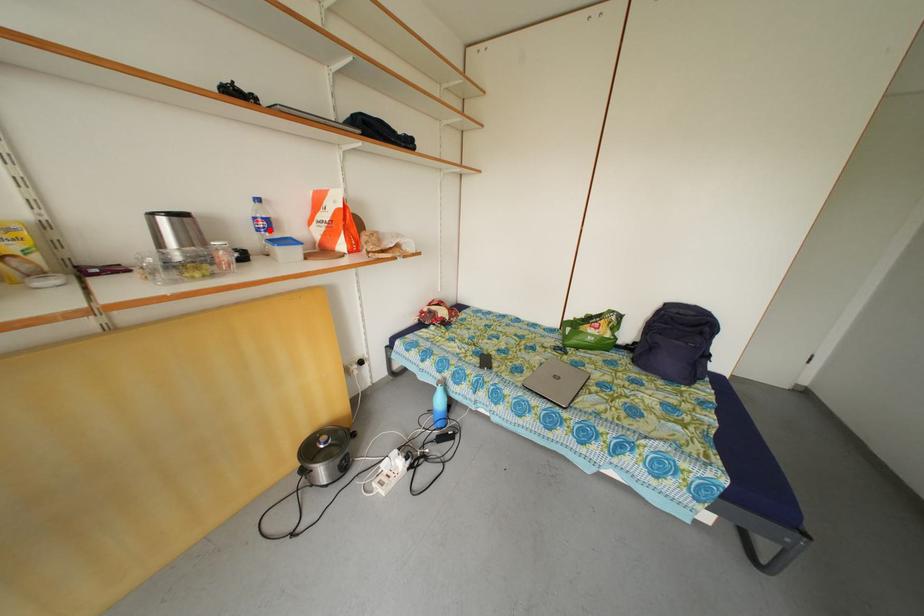
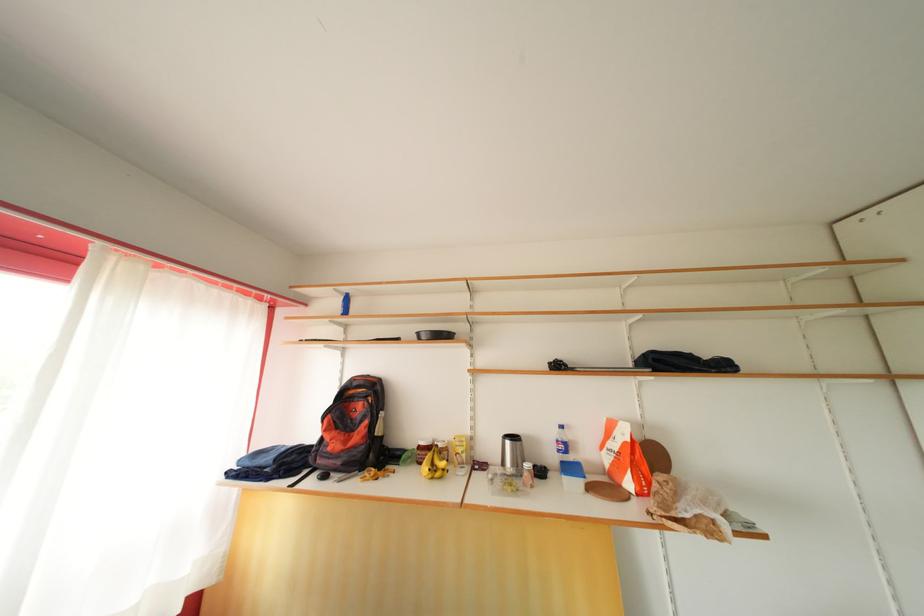
Locate, in the second image, the point that corresponds to the highlighted location in the first image.

(568, 453)